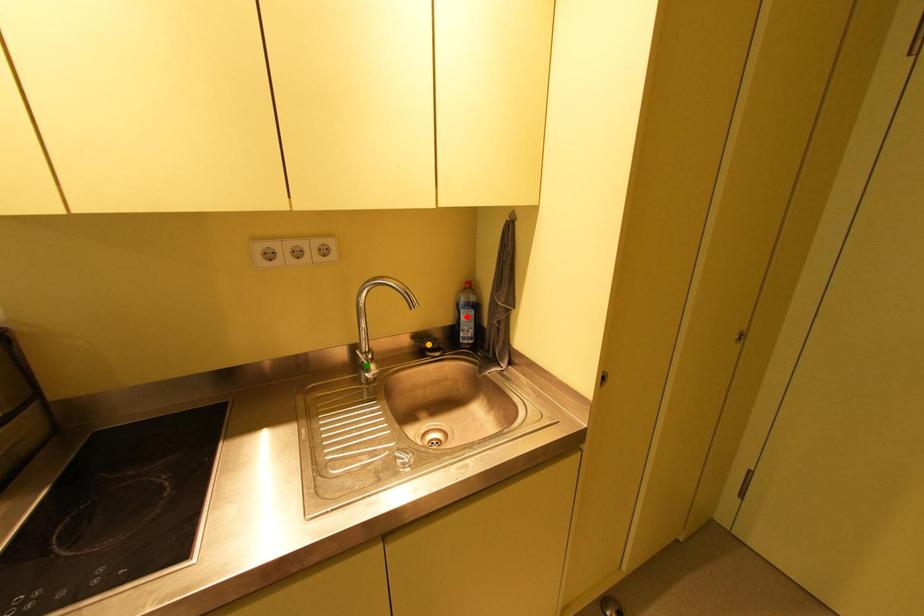
Order these from nearest to farthest:
red point
green point
orange point

red point
orange point
green point